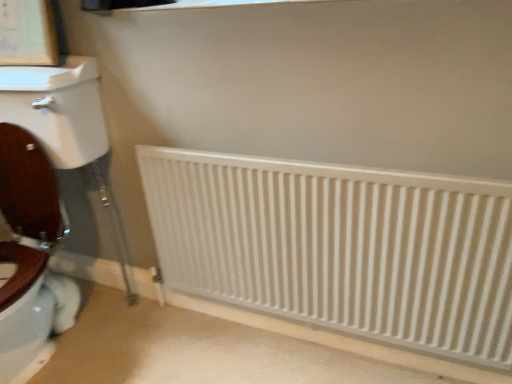
Locate an element on the screen. The height and width of the screenshot is (384, 512). free space to the left of white matte radiator at lower center is located at coordinates (189, 349).